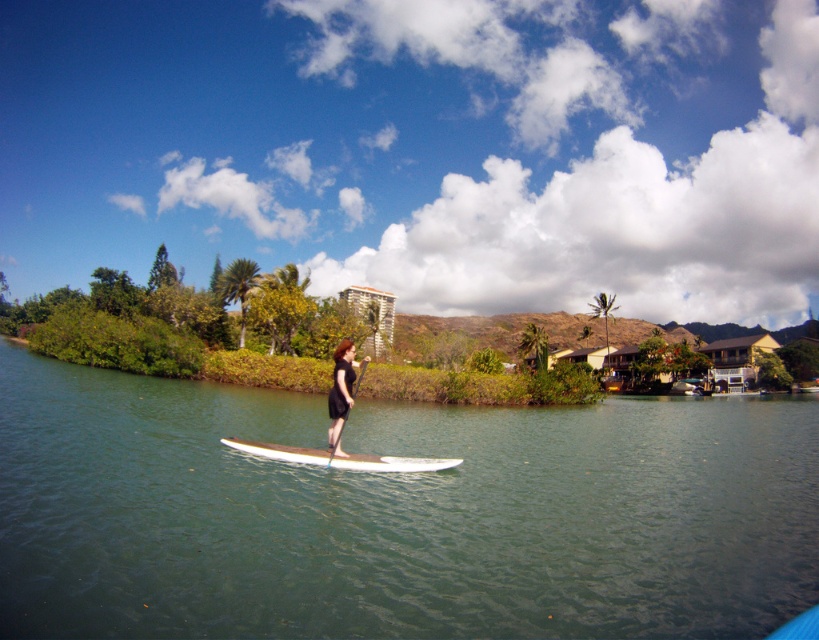
Question: Which of the following is the closest to the observer?

Choices:
 (A) green smooth water at center
 (B) white glossy paddleboard at center
 (C) white smooth surfboard at center

Answer: (A)

Question: Does white smooth surfboard at center have a lesser width compared to white glossy paddleboard at center?

Choices:
 (A) yes
 (B) no

Answer: (B)

Question: Which object is farther from the camera taking this photo?

Choices:
 (A) white glossy paddleboard at center
 (B) white smooth surfboard at center

Answer: (A)

Question: Considering the relative positions of green smooth water at center and white glossy paddleboard at center in the image provided, where is green smooth water at center located with respect to white glossy paddleboard at center?

Choices:
 (A) left
 (B) right

Answer: (B)

Question: Which of these objects is positioned farthest from the white glossy paddleboard at center?

Choices:
 (A) white smooth surfboard at center
 (B) green smooth water at center

Answer: (B)

Question: Can you confirm if white smooth surfboard at center is positioned above white glossy paddleboard at center?

Choices:
 (A) yes
 (B) no

Answer: (B)